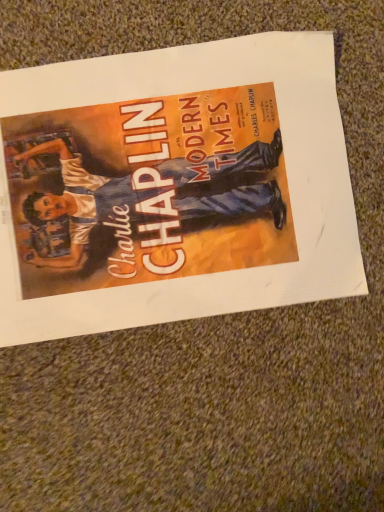
The height and width of the screenshot is (512, 384). What do you see at coordinates (173, 187) in the screenshot?
I see `matte paper poster at center` at bounding box center [173, 187].

Where is `matte paper poster at center`? matte paper poster at center is located at coordinates (173, 187).

This screenshot has width=384, height=512. Find the location of `matte paper poster at center`. matte paper poster at center is located at coordinates (173, 187).